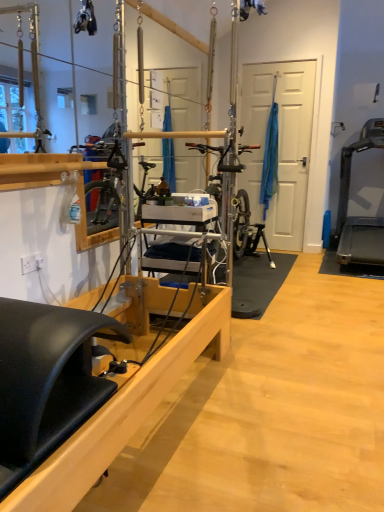
I want to click on free point above wooden pilates reformer at center (from a real-world perspective), so click(x=288, y=329).